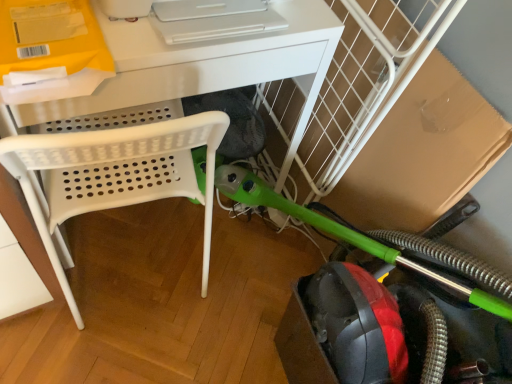
Question: Considering the relative sizes of white plastic desk at upper center and green rubber garden hose at lower right in the image provided, is white plastic desk at upper center taller than green rubber garden hose at lower right?

Choices:
 (A) yes
 (B) no

Answer: (A)

Question: Is green rubber garden hose at lower right at the back of white plastic desk at upper center?

Choices:
 (A) yes
 (B) no

Answer: (B)

Question: From a real-world perspective, is white plastic desk at upper center over green rubber garden hose at lower right?

Choices:
 (A) no
 (B) yes

Answer: (B)

Question: Considering the relative positions of white plastic desk at upper center and green rubber garden hose at lower right in the image provided, is white plastic desk at upper center in front of green rubber garden hose at lower right?

Choices:
 (A) no
 (B) yes

Answer: (A)

Question: Is the position of white plastic desk at upper center more distant than that of green rubber garden hose at lower right?

Choices:
 (A) yes
 (B) no

Answer: (A)

Question: From the image's perspective, is white plastic desk at upper center under green rubber garden hose at lower right?

Choices:
 (A) yes
 (B) no

Answer: (B)

Question: Does green rubber garden hose at lower right lie behind white plastic desk at upper center?

Choices:
 (A) yes
 (B) no

Answer: (B)

Question: Can you confirm if green rubber garden hose at lower right is bigger than white plastic desk at upper center?

Choices:
 (A) no
 (B) yes

Answer: (A)

Question: Does green rubber garden hose at lower right touch white plastic desk at upper center?

Choices:
 (A) no
 (B) yes

Answer: (A)

Question: Is green rubber garden hose at lower right wider than white plastic desk at upper center?

Choices:
 (A) yes
 (B) no

Answer: (B)

Question: Does green rubber garden hose at lower right have a greater height compared to white plastic desk at upper center?

Choices:
 (A) yes
 (B) no

Answer: (B)

Question: Could you tell me if green rubber garden hose at lower right is turned towards white plastic desk at upper center?

Choices:
 (A) no
 (B) yes

Answer: (A)

Question: Is point (243, 41) closer or farther from the camera than point (280, 205)?

Choices:
 (A) farther
 (B) closer

Answer: (B)